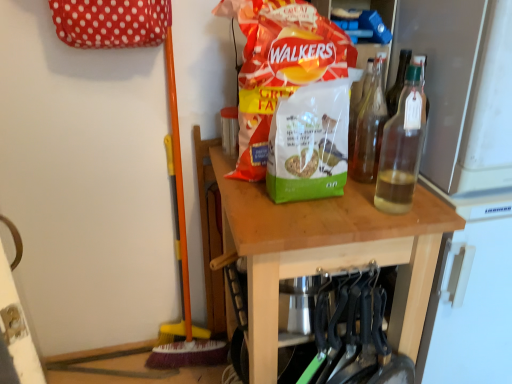
Question: Is green matte birdseed bag at center, which is the second waste in top-to-bottom order, far from matte plastic bag of walkers crisps at center, arranged as the first waste when viewed from the top?

Choices:
 (A) no
 (B) yes

Answer: (A)

Question: From the image's perspective, is green matte birdseed bag at center, which is the second waste in top-to-bottom order, under matte plastic bag of walkers crisps at center, the second waste positioned from the bottom?

Choices:
 (A) no
 (B) yes

Answer: (B)

Question: Could you tell me if green matte birdseed bag at center, which is the second waste in top-to-bottom order, is facing matte plastic bag of walkers crisps at center, arranged as the first waste when viewed from the top?

Choices:
 (A) no
 (B) yes

Answer: (A)

Question: Is green matte birdseed bag at center, the 1th waste positioned from the bottom, outside matte plastic bag of walkers crisps at center, the second waste positioned from the bottom?

Choices:
 (A) yes
 (B) no

Answer: (A)

Question: Is green matte birdseed bag at center, the 1th waste positioned from the bottom, oriented away from matte plastic bag of walkers crisps at center, arranged as the first waste when viewed from the top?

Choices:
 (A) yes
 (B) no

Answer: (A)

Question: From a real-world perspective, is green matte birdseed bag at center, the 1th waste positioned from the bottom, positioned above or below matte plastic bag of walkers crisps at center, the second waste positioned from the bottom?

Choices:
 (A) above
 (B) below

Answer: (B)

Question: Visually, is green matte birdseed bag at center, the 1th waste positioned from the bottom, positioned to the left or to the right of matte plastic bag of walkers crisps at center, the second waste positioned from the bottom?

Choices:
 (A) right
 (B) left

Answer: (A)

Question: Based on their sizes in the image, would you say green matte birdseed bag at center, which is the second waste in top-to-bottom order, is bigger or smaller than matte plastic bag of walkers crisps at center, the second waste positioned from the bottom?

Choices:
 (A) small
 (B) big

Answer: (A)

Question: Considering the positions of green matte birdseed bag at center, the 1th waste positioned from the bottom, and matte plastic bag of walkers crisps at center, the second waste positioned from the bottom, in the image, is green matte birdseed bag at center, the 1th waste positioned from the bottom, taller or shorter than matte plastic bag of walkers crisps at center, the second waste positioned from the bottom,?

Choices:
 (A) tall
 (B) short

Answer: (B)

Question: Considering their positions, is clear glass bottle at upper right, which is the first bottle in front-to-back order, located in front of or behind wooden table at center?

Choices:
 (A) behind
 (B) front

Answer: (B)

Question: Considering the positions of clear glass bottle at upper right, which is counted as the second bottle, starting from the back, and wooden table at center in the image, is clear glass bottle at upper right, which is counted as the second bottle, starting from the back, wider or thinner than wooden table at center?

Choices:
 (A) thin
 (B) wide

Answer: (A)

Question: Is clear glass bottle at upper right, which is counted as the second bottle, starting from the back, situated inside wooden table at center or outside?

Choices:
 (A) inside
 (B) outside

Answer: (B)

Question: Does point [414, 74] appear closer or farther from the camera than point [400, 271]?

Choices:
 (A) closer
 (B) farther

Answer: (A)

Question: From the image's perspective, is matte plastic bag of walkers crisps at center, arranged as the first waste when viewed from the top, above or below wooden table at center?

Choices:
 (A) above
 (B) below

Answer: (A)

Question: Considering the positions of matte plastic bag of walkers crisps at center, the second waste positioned from the bottom, and wooden table at center in the image, is matte plastic bag of walkers crisps at center, the second waste positioned from the bottom, taller or shorter than wooden table at center?

Choices:
 (A) short
 (B) tall

Answer: (A)